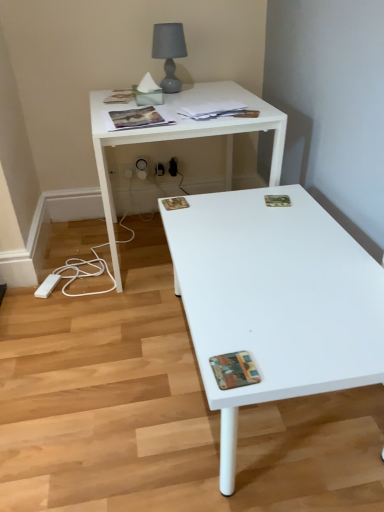
Question: In terms of size, does white plastic electric outlet at lower center, the 2th electric outlet positioned from the left, appear bigger or smaller than matte paper magazine at upper left, marked as the 1th magazine in a top-to-bottom arrangement?

Choices:
 (A) small
 (B) big

Answer: (A)

Question: Relative to matte paper magazine at upper left, marked as the 1th magazine in a top-to-bottom arrangement, is white plastic electric outlet at lower center, the 2th electric outlet positioned from the left, in front or behind?

Choices:
 (A) front
 (B) behind

Answer: (B)

Question: Which object is the farthest from the printed paper magazine at upper center, which appears as the second magazine when viewed from the front?

Choices:
 (A) matte gray lampshade at upper center
 (B) white plastic electric outlet at lower center, which is counted as the first electric outlet, starting from the left
 (C) white plastic electric outlet at lower center, the 2th electric outlet positioned from the left
 (D) camouflage paper magazine at upper right, the 2th magazine in the back-to-front sequence
 (E) matte paper magazine at upper left, marked as the 1th magazine in a top-to-bottom arrangement

Answer: (B)

Question: Which is nearer to the matte paper magazine at upper left, acting as the sixth magazine starting from the bottom?

Choices:
 (A) matte paper magazine at upper center, which ranks as the 3th magazine in back-to-front order
 (B) multicolored textured magazine at lower right, acting as the first magazine starting from the front
 (C) printed paper magazine at center, positioned as the 5th magazine in top-to-bottom order
 (D) white glossy desk at upper center
 (E) camouflage paper magazine at upper right, the fourth magazine in the top-to-bottom sequence

Answer: (D)